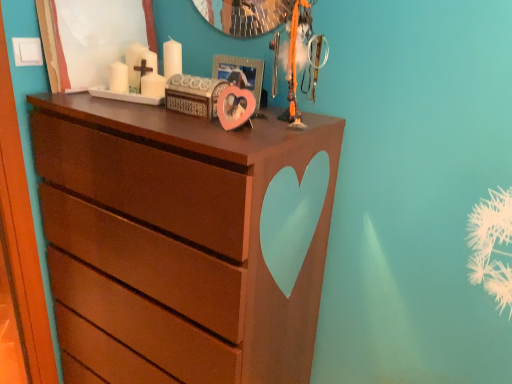
Question: Is pink matte heart at center next to brown matte chest of drawers at center?

Choices:
 (A) no
 (B) yes

Answer: (A)

Question: From a real-world perspective, does pink matte heart at center stand above brown matte chest of drawers at center?

Choices:
 (A) no
 (B) yes

Answer: (B)

Question: Is pink matte heart at center further to the viewer compared to brown matte chest of drawers at center?

Choices:
 (A) yes
 (B) no

Answer: (A)

Question: From the image's perspective, is pink matte heart at center on top of brown matte chest of drawers at center?

Choices:
 (A) no
 (B) yes

Answer: (B)

Question: Does pink matte heart at center turn towards brown matte chest of drawers at center?

Choices:
 (A) yes
 (B) no

Answer: (B)

Question: Is brown matte chest of drawers at center a part of pink matte heart at center?

Choices:
 (A) no
 (B) yes

Answer: (A)

Question: Is brown matte chest of drawers at center aimed at pink matte heart at center?

Choices:
 (A) no
 (B) yes

Answer: (A)

Question: From the image's perspective, is brown matte chest of drawers at center below pink matte heart at center?

Choices:
 (A) no
 (B) yes

Answer: (B)

Question: Considering the relative sizes of brown matte chest of drawers at center and pink matte heart at center in the image provided, is brown matte chest of drawers at center bigger than pink matte heart at center?

Choices:
 (A) no
 (B) yes

Answer: (B)

Question: Can you confirm if brown matte chest of drawers at center is smaller than pink matte heart at center?

Choices:
 (A) yes
 (B) no

Answer: (B)

Question: From a real-world perspective, does brown matte chest of drawers at center sit lower than pink matte heart at center?

Choices:
 (A) yes
 (B) no

Answer: (A)

Question: Can pink matte heart at center be found inside brown matte chest of drawers at center?

Choices:
 (A) no
 (B) yes

Answer: (A)

Question: Considering the positions of brown matte chest of drawers at center and pink matte heart at center in the image, is brown matte chest of drawers at center wider or thinner than pink matte heart at center?

Choices:
 (A) thin
 (B) wide

Answer: (B)